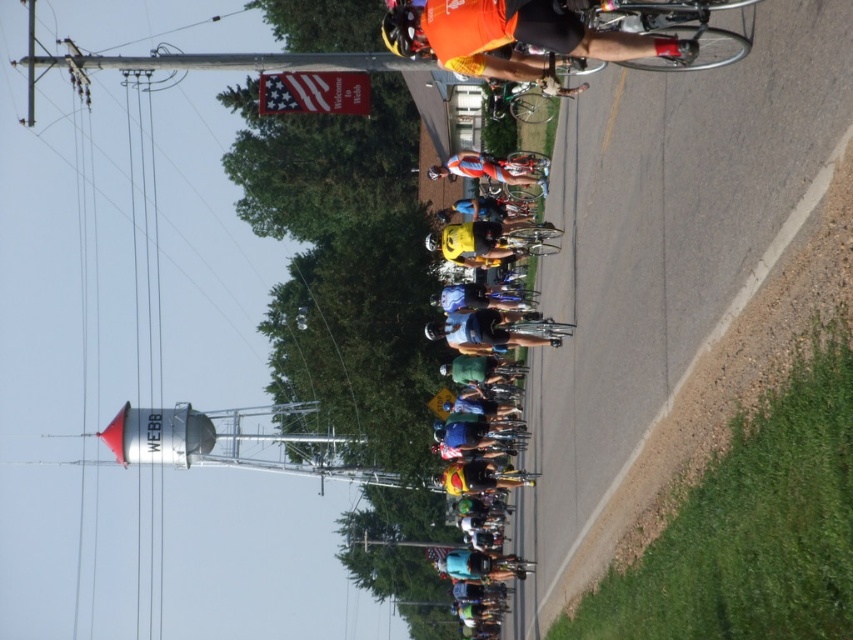
Does american flag banner at upper center come in front of shiny orange helmet at center?

That is False.

Is point (349, 80) positioned after point (402, 42)?

Yes, point (349, 80) is farther from viewer.

Locate an element on the screen. Image resolution: width=853 pixels, height=640 pixels. american flag banner at upper center is located at coordinates (314, 92).

Is point (265, 92) positioned after point (468, 157)?

Yes.

Does point (258, 109) come in front of point (436, 170)?

No, (258, 109) is further to viewer.

What are the coordinates of `american flag banner at upper center` in the screenshot? It's located at (314, 92).

Can you confirm if orange jersey cyclist at center is wider than shiny orange helmet at center?

Yes.

At what (x,y) coordinates should I click in order to perform the action: click on orange jersey cyclist at center. Please return your answer as a coordinate pair (x, y). The height and width of the screenshot is (640, 853). Looking at the image, I should click on (492, 166).